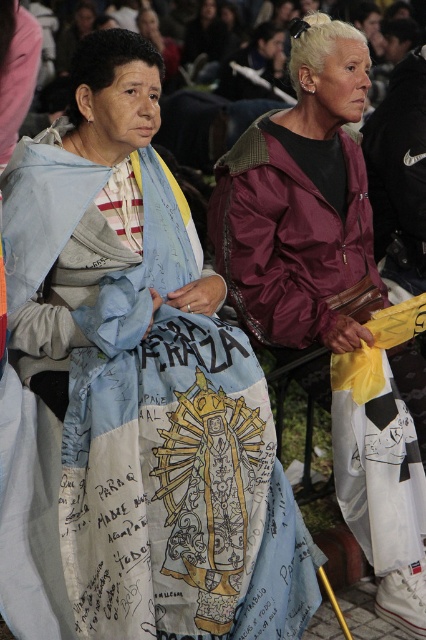
Question: Is the position of blue fabric shawl at left more distant than that of maroon nylon jacket at center?

Choices:
 (A) yes
 (B) no

Answer: (B)

Question: Can you confirm if blue fabric shawl at left is positioned to the left of maroon nylon jacket at center?

Choices:
 (A) no
 (B) yes

Answer: (B)

Question: Among these points, which one is nearest to the camera?

Choices:
 (A) (37, 416)
 (B) (371, 296)

Answer: (A)

Question: Observing the image, what is the correct spatial positioning of blue fabric shawl at left in reference to maroon nylon jacket at center?

Choices:
 (A) left
 (B) right

Answer: (A)

Question: Among these points, which one is nearest to the camera?

Choices:
 (A) (236, 216)
 (B) (232, 508)

Answer: (B)